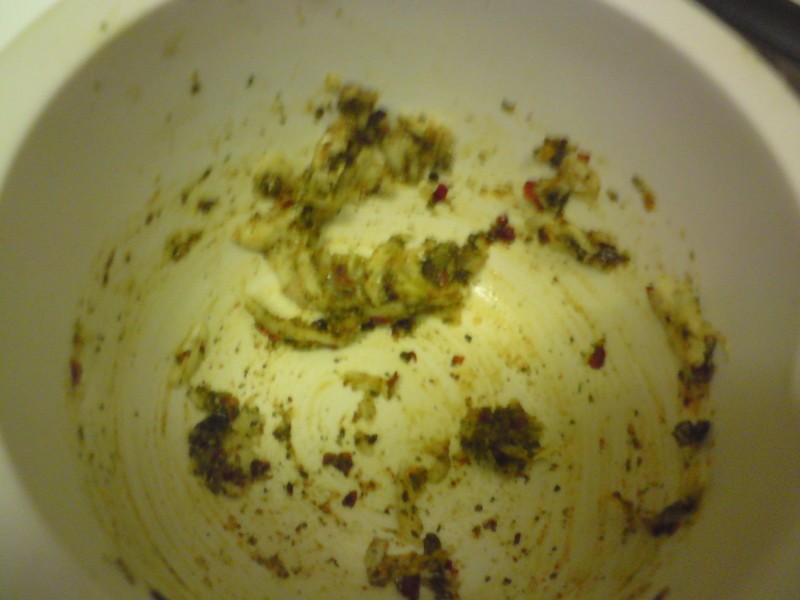
Where is `bowl`? bowl is located at coordinates click(x=748, y=226), click(x=76, y=177).